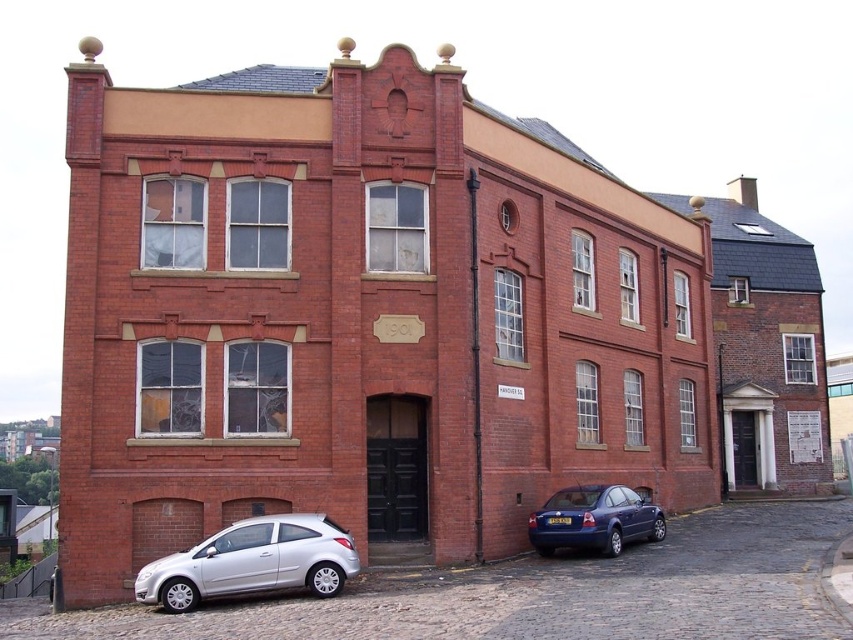
You are a delivery driver who needs to park your vehicle in front of the building. You see a silver metallic hatchback at lower left and a metallic blue sedan at lower right. Which parking spot is closer to the entrance of the building?

The silver metallic hatchback at lower left is to the left of the metallic blue sedan at lower right, so the silver metallic hatchback at lower left is closer to the entrance of the building.

You are a delivery driver who needs to park a 1.8 meter tall delivery box next to the silver metallic hatchback at lower left and the metallic blue sedan at lower right. Which vehicle should you place the box next to to ensure it doesn

The silver metallic hatchback at lower left has a greater height compared to the metallic blue sedan at lower right. Therefore, placing the delivery box next to the silver metallic hatchback at lower left would be more appropriate as its height aligns better with the box.

Looking at this image, you are standing in front of the two story brick building and want to park your car. You see a silver metallic hatchback at lower left and a metallic blue sedan at lower right. Which car is closer to you?

The silver metallic hatchback at lower left is closer to the viewer than the metallic blue sedan at lower right.